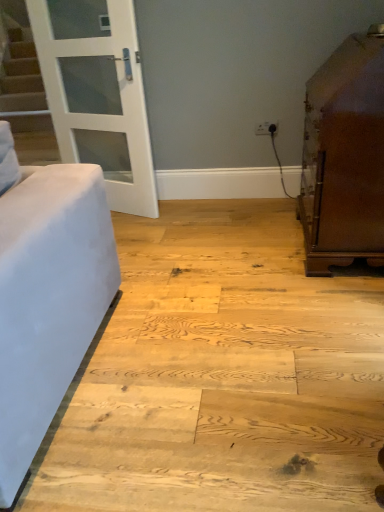
Question: Would you say brown polished cabinet at right is inside or outside white plastic outlet at upper center?

Choices:
 (A) outside
 (B) inside

Answer: (A)

Question: From a real-world perspective, is brown polished cabinet at right physically located above or below white plastic outlet at upper center?

Choices:
 (A) below
 (B) above

Answer: (B)

Question: Which object is positioned farthest from the brown polished cabinet at right?

Choices:
 (A) white glass door at upper left
 (B) white plastic outlet at upper center

Answer: (A)

Question: Considering the real-world distances, which object is closest to the white plastic outlet at upper center?

Choices:
 (A) brown polished cabinet at right
 (B) white glass door at upper left

Answer: (A)